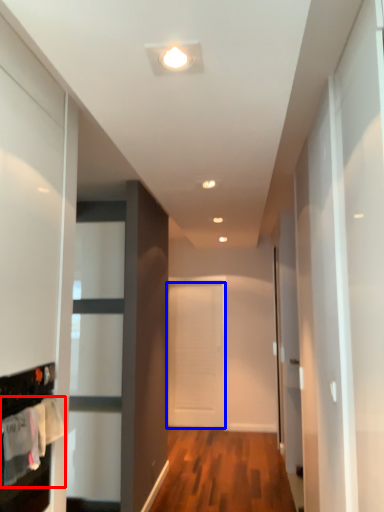
Question: Which point is further to the camera, laundry (highlighted by a red box) or door (highlighted by a blue box)?

Choices:
 (A) laundry
 (B) door

Answer: (B)